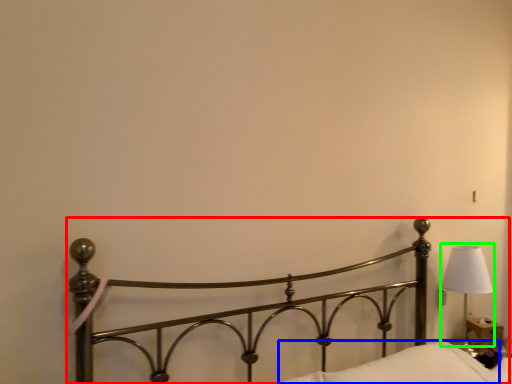
Question: Based on their relative distances, which object is farther from bed (highlighted by a red box)? Choose from pillow (highlighted by a blue box) and lamp (highlighted by a green box).

Choices:
 (A) pillow
 (B) lamp

Answer: (B)